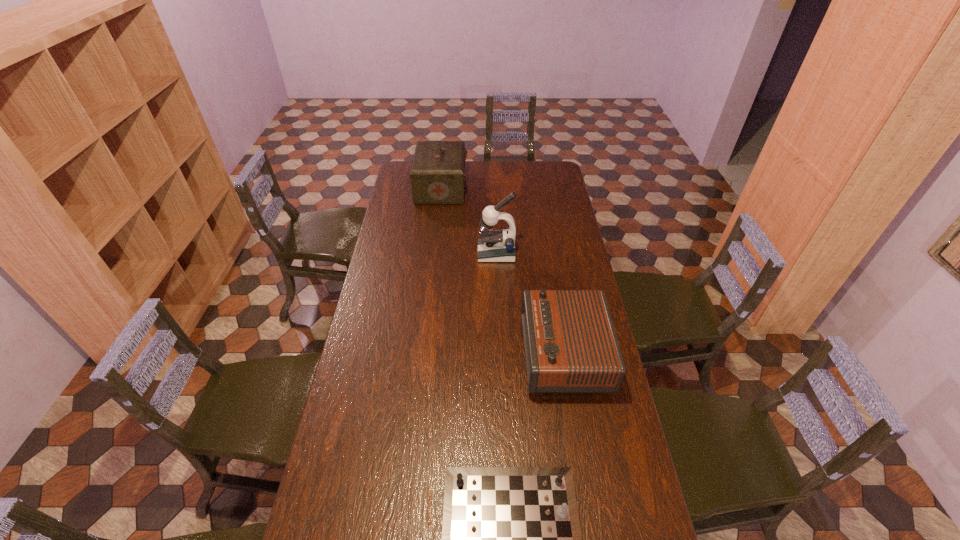
At what (x,y) coordinates should I click in order to perform the action: click on object present at the far edge. Please return your answer as a coordinate pair (x, y). Image resolution: width=960 pixels, height=540 pixels. Looking at the image, I should click on (437, 175).

Where is `object located in the left edge section of the desktop`? object located in the left edge section of the desktop is located at coordinates (437, 175).

Locate an element on the screen. object at the right edge is located at coordinates (570, 344).

Identify the location of object at the far left corner. The height and width of the screenshot is (540, 960). (437, 175).

The image size is (960, 540). Identify the location of vacant space at the far edge. (500, 174).

In order to click on vacant region at the left edge of the desktop in this screenshot , I will do `click(418, 232)`.

Identify the location of free space at the right edge of the desktop. The image size is (960, 540). (618, 528).

Identify the location of free space between the second shortest object and the farthest object. (502, 271).

In order to click on unoccupied position between the radio receiver and the farthest object in this screenshot , I will do `click(502, 271)`.

Locate an element on the screen. This screenshot has height=540, width=960. free area in between the farthest object and the microscope is located at coordinates (468, 221).